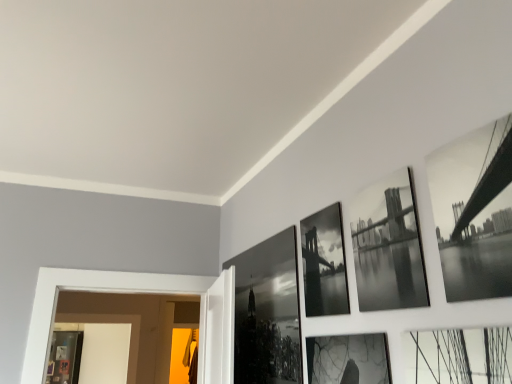
Question: Considering the relative positions of black glossy photo frame at center, acting as the third picture frame starting from the right, and black glossy photo frame at upper center, positioned as the 3th picture frame in left-to-right order, in the image provided, is black glossy photo frame at center, acting as the third picture frame starting from the right, to the left or to the right of black glossy photo frame at upper center, positioned as the 3th picture frame in left-to-right order,?

Choices:
 (A) left
 (B) right

Answer: (A)

Question: In the image, is black glossy photo frame at center, the 2th picture frame in the left-to-right sequence, positioned in front of or behind black glossy photo frame at upper center, which is counted as the third picture frame, starting from the back?

Choices:
 (A) front
 (B) behind

Answer: (B)

Question: Based on their relative distances, which object is farther from the black glossy photo frame at center, which appears as the third picture frame when viewed from the front?

Choices:
 (A) black glossy photo frame at center, arranged as the fourth picture frame when viewed from the front
 (B) black glossy bridge at upper right, acting as the first picture frame starting from the right
 (C) black glossy photo frame at upper center, the second picture frame viewed from the front

Answer: (B)

Question: Which object is positioned farthest from the black glossy photo frame at center, the 2th picture frame in the left-to-right sequence?

Choices:
 (A) black glossy photo frame at center, acting as the 1th picture frame starting from the left
 (B) black glossy bridge at upper right, the fourth picture frame when ordered from back to front
 (C) black glossy photo frame at upper center, the second picture frame viewed from the front

Answer: (B)